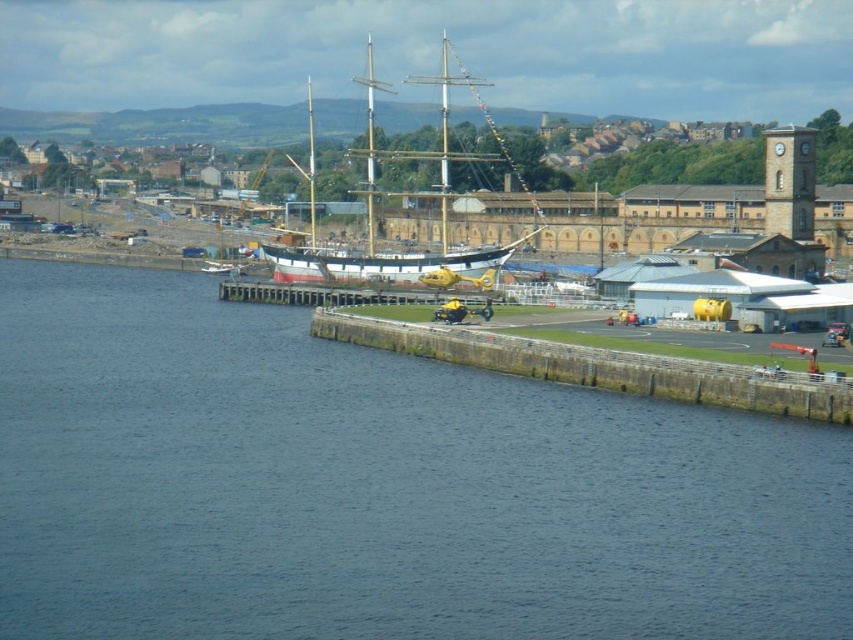
Question: Can you confirm if concrete dock at lower right is positioned above white wooden ship at center?

Choices:
 (A) yes
 (B) no

Answer: (B)

Question: Which of the following is the farthest from the observer?

Choices:
 (A) (709, 364)
 (B) (10, 275)

Answer: (B)

Question: Which of the following is the farthest from the observer?

Choices:
 (A) blue water at lower left
 (B) white wooden ship at center
 (C) concrete dock at lower right

Answer: (B)

Question: Which of the following is the farthest from the observer?

Choices:
 (A) (320, 624)
 (B) (428, 284)

Answer: (B)

Question: Is concrete dock at lower right closer to camera compared to white wooden ship at center?

Choices:
 (A) no
 (B) yes

Answer: (B)

Question: Is blue water at lower left below yellow matte helicopter at center?

Choices:
 (A) no
 (B) yes

Answer: (B)